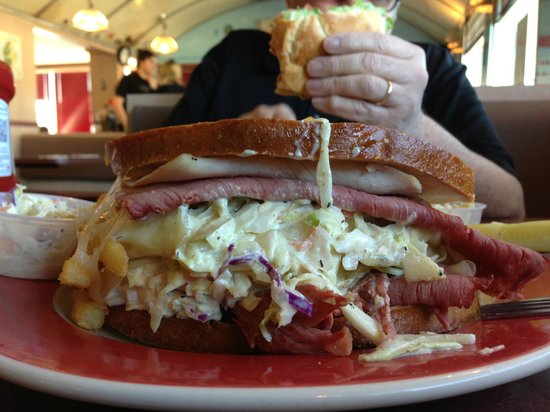
At what (x,y) coordinates should I click in order to perform the action: click on red plate. Please return your answer as a coordinate pair (x, y). Looking at the image, I should click on 102,370.